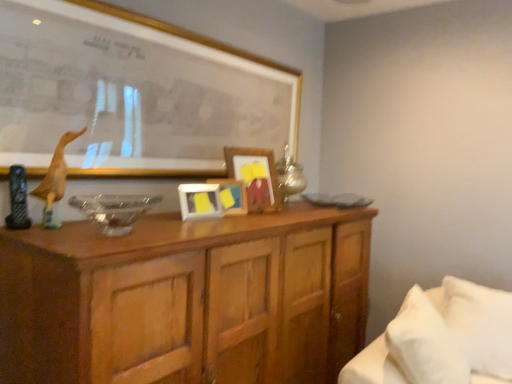
What is the approximate width of white soft pillow at lower right?

It is 14.26 inches.

What do you see at coordinates (480, 325) in the screenshot? I see `white soft pillow at lower right` at bounding box center [480, 325].

What do you see at coordinates (56, 173) in the screenshot? The height and width of the screenshot is (384, 512). I see `wooden duckling at left` at bounding box center [56, 173].

Measure the distance between wooden picture frame at center, the first picture frame from the back, and camera.

The distance of wooden picture frame at center, the first picture frame from the back, from camera is 6.32 feet.

How much space does yellow matte picture frame at center, which is the second picture frame in back-to-front order, occupy vertically?

16.90 centimeters.

The width and height of the screenshot is (512, 384). I want to click on matte gold picture frame at upper center, which appears as the first picture frame when viewed from the front, so click(132, 93).

The height and width of the screenshot is (384, 512). Find the location of `white soft pillow at lower right`. white soft pillow at lower right is located at coordinates (480, 325).

Is matte yellow picture frame at center, the second picture frame in the front-to-back sequence, aimed at matte gold picture frame at upper center, positioned as the 4th picture frame in back-to-front order?

No.

Consider the image. Which of these two, matte yellow picture frame at center, the second picture frame in the front-to-back sequence, or matte gold picture frame at upper center, which appears as the first picture frame when viewed from the front, is bigger?

Bigger between the two is matte gold picture frame at upper center, which appears as the first picture frame when viewed from the front.

Which object is more forward, matte yellow picture frame at center, which ranks as the third picture frame in back-to-front order, or matte gold picture frame at upper center, positioned as the 4th picture frame in back-to-front order?

matte gold picture frame at upper center, positioned as the 4th picture frame in back-to-front order, is in front.

Is matte yellow picture frame at center, which ranks as the third picture frame in back-to-front order, at the left side of matte gold picture frame at upper center, which appears as the first picture frame when viewed from the front?

No.

Can you confirm if matte yellow picture frame at center, the second picture frame in the front-to-back sequence, is thinner than wooden picture frame at center, the fourth picture frame viewed from the front?

Yes.

How distant is matte yellow picture frame at center, which ranks as the third picture frame in back-to-front order, from wooden picture frame at center, the first picture frame from the back?

The distance of matte yellow picture frame at center, which ranks as the third picture frame in back-to-front order, from wooden picture frame at center, the first picture frame from the back, is 26.98 centimeters.

Which point is more forward, (184, 200) or (251, 174)?

The point (184, 200) is closer.

Is yellow matte picture frame at center, acting as the 3th picture frame starting from the front, next to matte gold picture frame at upper center, positioned as the 4th picture frame in back-to-front order?

No, yellow matte picture frame at center, acting as the 3th picture frame starting from the front, is not beside matte gold picture frame at upper center, positioned as the 4th picture frame in back-to-front order.

Do you think yellow matte picture frame at center, acting as the 3th picture frame starting from the front, is within matte gold picture frame at upper center, which appears as the first picture frame when viewed from the front, or outside of it?

yellow matte picture frame at center, acting as the 3th picture frame starting from the front, is spatially situated outside matte gold picture frame at upper center, which appears as the first picture frame when viewed from the front.

Is yellow matte picture frame at center, which is the second picture frame in back-to-front order, bigger or smaller than matte gold picture frame at upper center, positioned as the 4th picture frame in back-to-front order?

In the image, yellow matte picture frame at center, which is the second picture frame in back-to-front order, appears to be smaller than matte gold picture frame at upper center, positioned as the 4th picture frame in back-to-front order.

Is yellow matte picture frame at center, which is the second picture frame in back-to-front order, positioned behind matte gold picture frame at upper center, positioned as the 4th picture frame in back-to-front order?

Yes, the depth of yellow matte picture frame at center, which is the second picture frame in back-to-front order, is greater than that of matte gold picture frame at upper center, positioned as the 4th picture frame in back-to-front order.

Between yellow matte picture frame at center, acting as the 3th picture frame starting from the front, and wooden cabinet at center, which one appears on the right side from the viewer's perspective?

From the viewer's perspective, wooden cabinet at center appears more on the right side.

Consider the image. Is yellow matte picture frame at center, which is the second picture frame in back-to-front order, touching wooden cabinet at center?

No, yellow matte picture frame at center, which is the second picture frame in back-to-front order, is not making contact with wooden cabinet at center.

From the image's perspective, which is below, yellow matte picture frame at center, acting as the 3th picture frame starting from the front, or wooden cabinet at center?

From the image's view, wooden cabinet at center is below.

Which object is further away from the camera taking this photo, yellow matte picture frame at center, acting as the 3th picture frame starting from the front, or wooden cabinet at center?

yellow matte picture frame at center, acting as the 3th picture frame starting from the front, is further from the camera.

Considering the sizes of white soft pillow at lower right and wooden picture frame at center, the fourth picture frame viewed from the front, in the image, is white soft pillow at lower right taller or shorter than wooden picture frame at center, the fourth picture frame viewed from the front,?

In the image, white soft pillow at lower right appears to be taller than wooden picture frame at center, the fourth picture frame viewed from the front.

From the image's perspective, does white soft pillow at lower right appear higher than wooden picture frame at center, the fourth picture frame viewed from the front?

No, from the image's perspective, white soft pillow at lower right is not on top of wooden picture frame at center, the fourth picture frame viewed from the front.

I want to click on pillow that is in front of the wooden picture frame at center, the first picture frame from the back, so [x=480, y=325].

Considering the positions of objects white soft bed at lower right and wooden picture frame at center, the first picture frame from the back, in the image provided, who is more to the left, white soft bed at lower right or wooden picture frame at center, the first picture frame from the back,?

wooden picture frame at center, the first picture frame from the back, is more to the left.

Are white soft bed at lower right and wooden picture frame at center, the fourth picture frame viewed from the front, located far from each other?

Actually, white soft bed at lower right and wooden picture frame at center, the fourth picture frame viewed from the front, are a little close together.

Consider the image. From the image's perspective, between white soft bed at lower right and wooden picture frame at center, the first picture frame from the back, who is located below?

white soft bed at lower right.

Can you tell me how much white soft bed at lower right and wooden picture frame at center, the fourth picture frame viewed from the front, differ in facing direction?

30.8 degrees.

Which of these two, matte gold picture frame at upper center, positioned as the 4th picture frame in back-to-front order, or matte yellow picture frame at center, which ranks as the third picture frame in back-to-front order, is wider?

With larger width is matte gold picture frame at upper center, positioned as the 4th picture frame in back-to-front order.

Looking at this image, do you think matte gold picture frame at upper center, which appears as the first picture frame when viewed from the front, is within matte yellow picture frame at center, the second picture frame in the front-to-back sequence, or outside of it?

matte gold picture frame at upper center, which appears as the first picture frame when viewed from the front, exists outside the volume of matte yellow picture frame at center, the second picture frame in the front-to-back sequence.

Is matte gold picture frame at upper center, positioned as the 4th picture frame in back-to-front order, far from matte yellow picture frame at center, the second picture frame in the front-to-back sequence?

No, matte gold picture frame at upper center, positioned as the 4th picture frame in back-to-front order, is not far away from matte yellow picture frame at center, the second picture frame in the front-to-back sequence.

From the image's perspective, which one is positioned higher, matte gold picture frame at upper center, positioned as the 4th picture frame in back-to-front order, or matte yellow picture frame at center, which ranks as the third picture frame in back-to-front order?

matte gold picture frame at upper center, positioned as the 4th picture frame in back-to-front order, appears higher in the image.

At what (x,y) coordinates should I click in order to perform the action: click on picture frame that is the 1st one when counting rightward from the matte gold picture frame at upper center, positioned as the 4th picture frame in back-to-front order. Please return your answer as a coordinate pair (x, y). This screenshot has height=384, width=512. Looking at the image, I should click on point(200,201).

What are the coordinates of `the 2nd picture frame positioned above the matte yellow picture frame at center, which ranks as the third picture frame in back-to-front order (from the image's perspective)` in the screenshot? It's located at (255, 177).

Considering their positions, is wooden cabinet at center positioned closer to matte gold picture frame at upper center, which appears as the first picture frame when viewed from the front, than white soft bed at lower right?

wooden cabinet at center is positioned closer to the anchor matte gold picture frame at upper center, which appears as the first picture frame when viewed from the front.

Based on their spatial positions, is matte yellow picture frame at center, the second picture frame in the front-to-back sequence, or white soft bed at lower right further from yellow matte picture frame at center, which is the second picture frame in back-to-front order?

white soft bed at lower right is further to yellow matte picture frame at center, which is the second picture frame in back-to-front order.

In the scene shown: Considering their positions, is white soft pillow at lower right positioned closer to matte yellow picture frame at center, which ranks as the third picture frame in back-to-front order, than white soft bed at lower right?

white soft bed at lower right.

Looking at the image, which one is located closer to wooden duckling at left, white soft pillow at lower right or wooden picture frame at center, the first picture frame from the back?

wooden picture frame at center, the first picture frame from the back, lies closer to wooden duckling at left than the other object.

Considering their positions, is matte gold picture frame at upper center, positioned as the 4th picture frame in back-to-front order, positioned closer to yellow matte picture frame at center, which is the second picture frame in back-to-front order, than wooden cabinet at center?

matte gold picture frame at upper center, positioned as the 4th picture frame in back-to-front order, is closer to yellow matte picture frame at center, which is the second picture frame in back-to-front order.

Considering their positions, is wooden cabinet at center positioned closer to wooden duckling at left than yellow matte picture frame at center, which is the second picture frame in back-to-front order?

Among the two, yellow matte picture frame at center, which is the second picture frame in back-to-front order, is located nearer to wooden duckling at left.

Estimate the real-world distances between objects in this image. Which object is further from matte gold picture frame at upper center, which appears as the first picture frame when viewed from the front, yellow matte picture frame at center, acting as the 3th picture frame starting from the front, or white soft bed at lower right?

Among the two, white soft bed at lower right is located further to matte gold picture frame at upper center, which appears as the first picture frame when viewed from the front.

Based on their spatial positions, is matte yellow picture frame at center, which ranks as the third picture frame in back-to-front order, or wooden duckling at left further from wooden cabinet at center?

wooden duckling at left lies further to wooden cabinet at center than the other object.

Find the location of `cabinetry between wooden duckling at left and white soft pillow at lower right`. cabinetry between wooden duckling at left and white soft pillow at lower right is located at coordinates (187, 299).

You are a GUI agent. You are given a task and a screenshot of the screen. Output one action in this format:
    pyautogui.click(x=<x>, y=<y>)
    Task: Click on the bed between matte gold picture frame at upper center, which appears as the first picture frame when viewed from the front, and wooden cabinet at center, in the vertical direction
    Image resolution: width=512 pixels, height=384 pixels.
    Given the screenshot: What is the action you would take?
    pyautogui.click(x=441, y=338)

This screenshot has height=384, width=512. I want to click on cabinetry between yellow matte picture frame at center, acting as the 3th picture frame starting from the front, and white soft bed at lower right, so click(x=187, y=299).

At what (x,y) coordinates should I click in order to perform the action: click on animal between matte gold picture frame at upper center, positioned as the 4th picture frame in back-to-front order, and matte yellow picture frame at center, the second picture frame in the front-to-back sequence, in the vertical direction. Please return your answer as a coordinate pair (x, y). The width and height of the screenshot is (512, 384). Looking at the image, I should click on (56, 173).